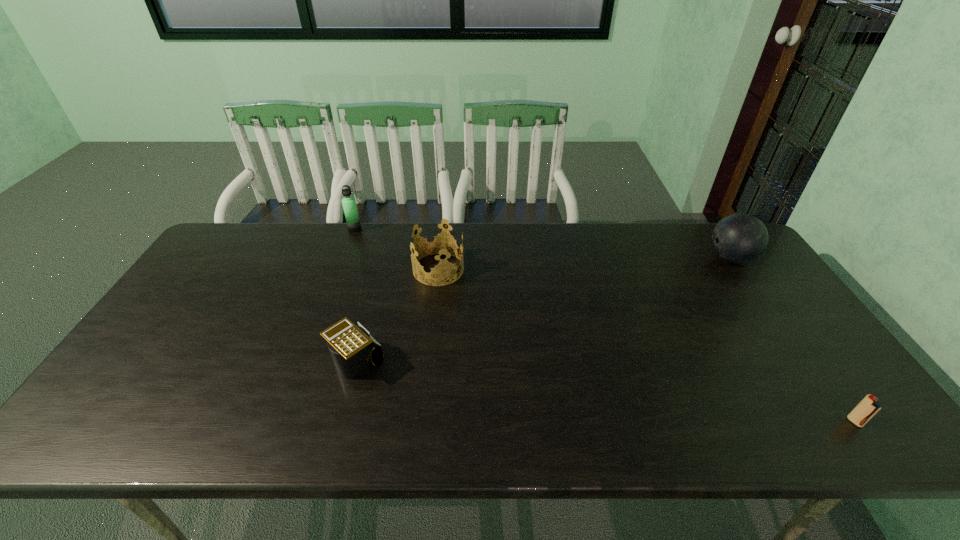
Identify the location of vacant area that lies between the leftmost object and the bowling ball. The image size is (960, 540). (542, 244).

I want to click on free space that is in between the fourth farthest object and the bowling ball, so click(542, 310).

Find the location of a particular element. vacant region between the crown and the bowling ball is located at coordinates (585, 264).

Where is `empty space that is in between the third object from right to left and the farthest object`? empty space that is in between the third object from right to left and the farthest object is located at coordinates (396, 249).

Find the location of a particular element. The height and width of the screenshot is (540, 960). free space between the crown and the thermos bottle is located at coordinates (396, 249).

The image size is (960, 540). What are the coordinates of `vacant area between the fourth farthest object and the bowling ball` in the screenshot? It's located at (542, 310).

Identify the location of empty space between the nearest object and the crown. This screenshot has height=540, width=960. (646, 346).

Find the location of `vacant area that lies between the third object from left to right and the thermos bottle`. vacant area that lies between the third object from left to right and the thermos bottle is located at coordinates (396, 249).

Where is `empty space that is in between the leftmost object and the nearest object`? The width and height of the screenshot is (960, 540). empty space that is in between the leftmost object and the nearest object is located at coordinates (605, 325).

Select which object is the closest to the fourth object from right to left. Please provide its 2D coordinates. Your answer should be formatted as a tuple, i.e. [(x, y)], where the tuple contains the x and y coordinates of a point satisfying the conditions above.

[(436, 245)]